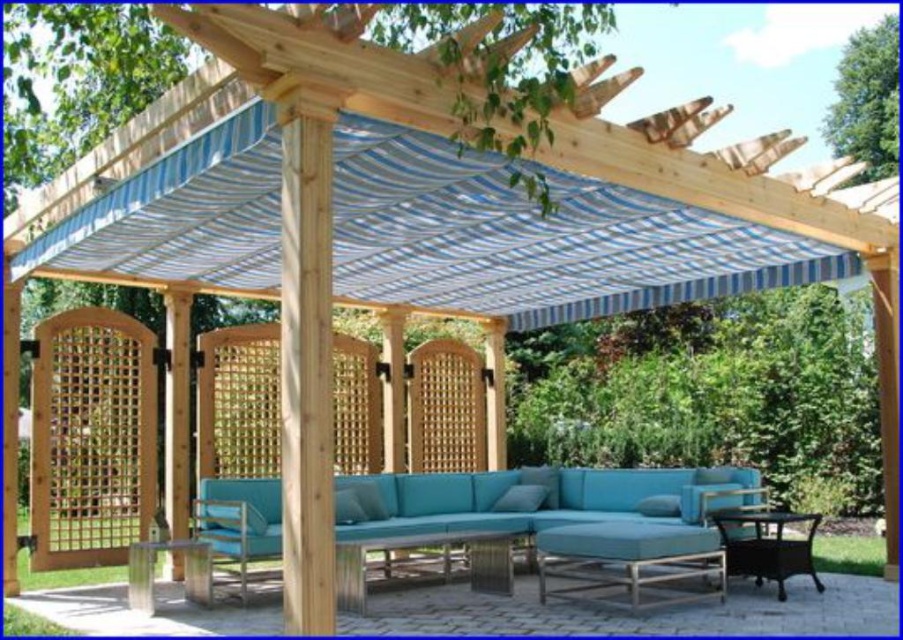
Is metallic silver chair at lower left positioned at the back of rustic wood side table at lower right?

Yes, it is.

Where is `metallic silver chair at lower left`? The image size is (903, 640). metallic silver chair at lower left is located at coordinates (238, 522).

Find the location of a particular element. teal fabric ottoman at center is located at coordinates (630, 561).

You are a GUI agent. You are given a task and a screenshot of the screen. Output one action in this format:
    pyautogui.click(x=<x>, y=<y>)
    Task: Click on the teal fabric ottoman at center
    
    Given the screenshot: What is the action you would take?
    click(630, 561)

Is teal fabric ottoman at center positioned behind rustic wood side table at lower right?

No, it is not.

Which of these two, teal fabric ottoman at center or rustic wood side table at lower right, stands taller?

Standing taller between the two is teal fabric ottoman at center.

Who is more forward, (541, 548) or (780, 516)?

Point (541, 548)

The width and height of the screenshot is (903, 640). Find the location of `teal fabric ottoman at center`. teal fabric ottoman at center is located at coordinates (630, 561).